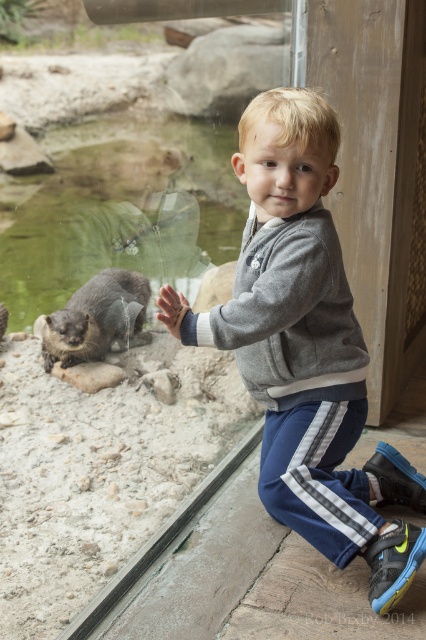
Question: Which point is closer to the camera taking this photo?

Choices:
 (A) (131, 291)
 (B) (331, 468)
 (C) (245, 355)

Answer: (C)

Question: Among these objects, which one is farthest from the camera?

Choices:
 (A) brown furry otter at lower left
 (B) transparent glass door at center

Answer: (A)

Question: Does gray heathered sweatshirt at center appear over brown furry otter at lower left?

Choices:
 (A) no
 (B) yes

Answer: (B)

Question: Is transparent glass door at center further to camera compared to brown furry otter at lower left?

Choices:
 (A) yes
 (B) no

Answer: (B)

Question: Is gray fleece jacket at center smaller than brown furry otter at lower left?

Choices:
 (A) no
 (B) yes

Answer: (A)

Question: Among these points, which one is farthest from the camera?

Choices:
 (A) (152, 100)
 (B) (241, 364)
 (C) (298, 268)
 (D) (115, 324)

Answer: (D)